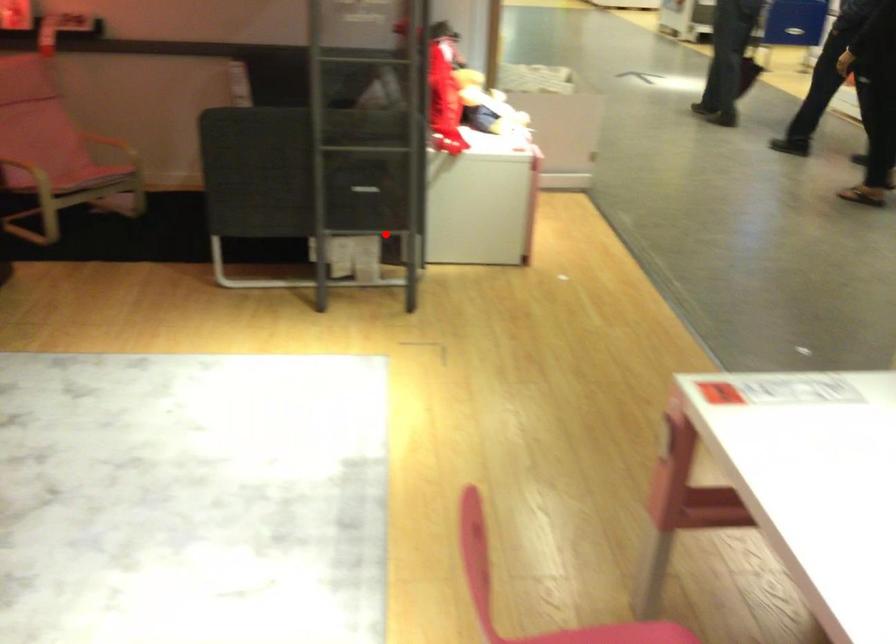
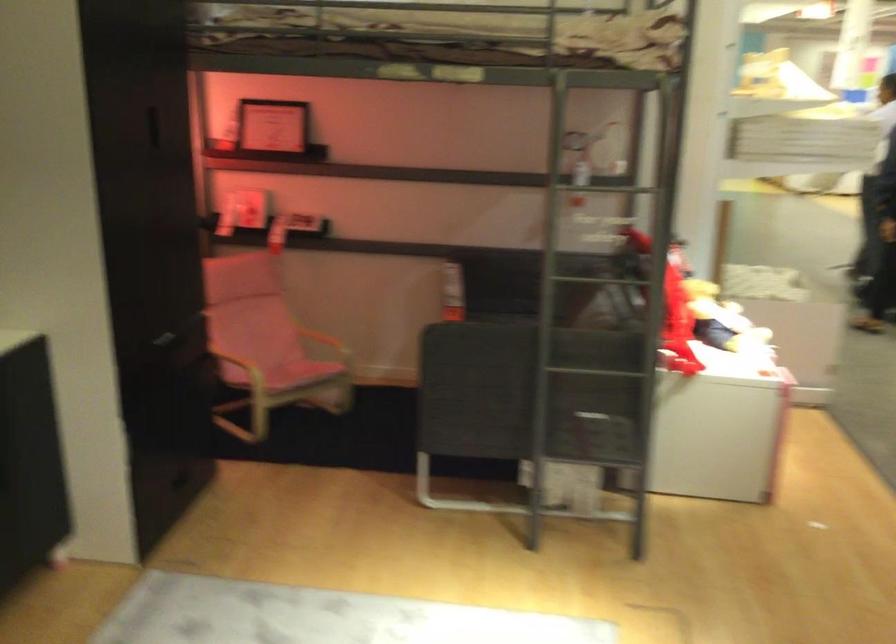
In the second image, find the point that corresponds to the highlighted location in the first image.

(607, 462)